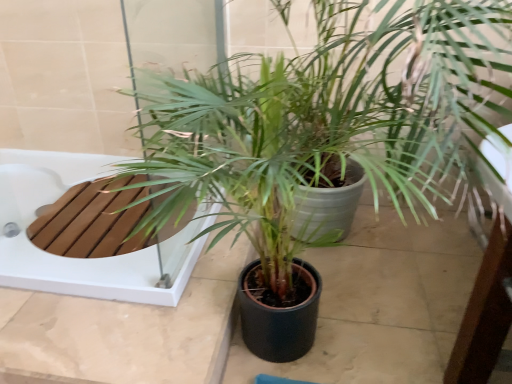
This screenshot has width=512, height=384. Identify the location of wooden at left. (69, 257).

Measure the distance between point (67, 167) and camera.

The depth of point (67, 167) is 2.03 meters.

What do you see at coordinates (69, 257) in the screenshot?
I see `wooden at left` at bounding box center [69, 257].

I want to click on wooden at left, so click(x=69, y=257).